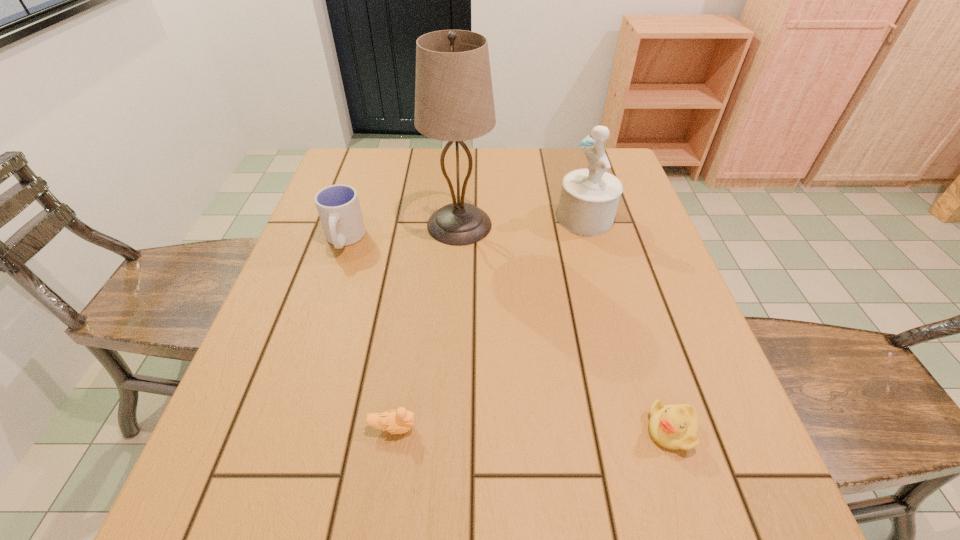
At what (x,y) coordinates should I click in order to perform the action: click on the closest object to the leftmost object. Please return your answer as a coordinate pair (x, y). The width and height of the screenshot is (960, 540). Looking at the image, I should click on (454, 101).

Where is `object that is the second closest to the third shortest object`? The width and height of the screenshot is (960, 540). object that is the second closest to the third shortest object is located at coordinates (399, 421).